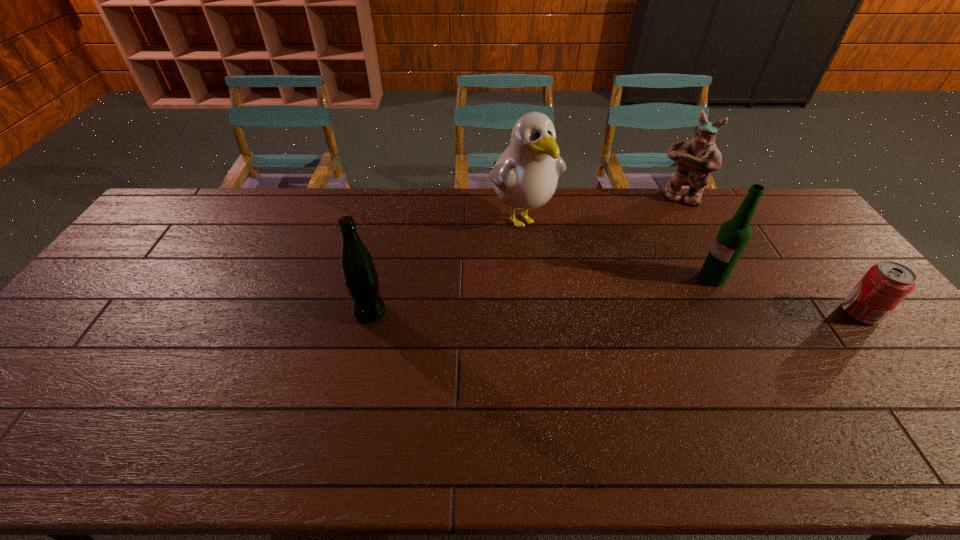
This screenshot has width=960, height=540. Identify the location of free spot located 0.200m on the back of the soda can. click(x=812, y=253).

In order to click on free space located on the front-facing side of the figurine in this screenshot , I will do `click(666, 237)`.

The width and height of the screenshot is (960, 540). What are the coordinates of `vacant space located on the front-facing side of the figurine` in the screenshot? It's located at (662, 252).

Locate an element on the screen. The width and height of the screenshot is (960, 540). vacant space located on the front-facing side of the figurine is located at coordinates (656, 278).

You are a GUI agent. You are given a task and a screenshot of the screen. Output one action in this format:
    pyautogui.click(x=<x>, y=<y>)
    Task: Click on the free region located on the beak of the gull
    
    Given the screenshot: What is the action you would take?
    pyautogui.click(x=564, y=275)

The width and height of the screenshot is (960, 540). In order to click on free space located on the beak of the gull in this screenshot , I will do click(548, 254).

Where is `free region located on the beak of the gull`? Image resolution: width=960 pixels, height=540 pixels. free region located on the beak of the gull is located at coordinates (568, 279).

I want to click on vacant position located 0.360m on the label of the third farthest object, so click(613, 334).

Locate an element on the screen. This screenshot has width=960, height=540. vacant space situated 0.060m on the label of the third farthest object is located at coordinates (690, 291).

I want to click on free space located on the label of the third farthest object, so click(x=663, y=306).